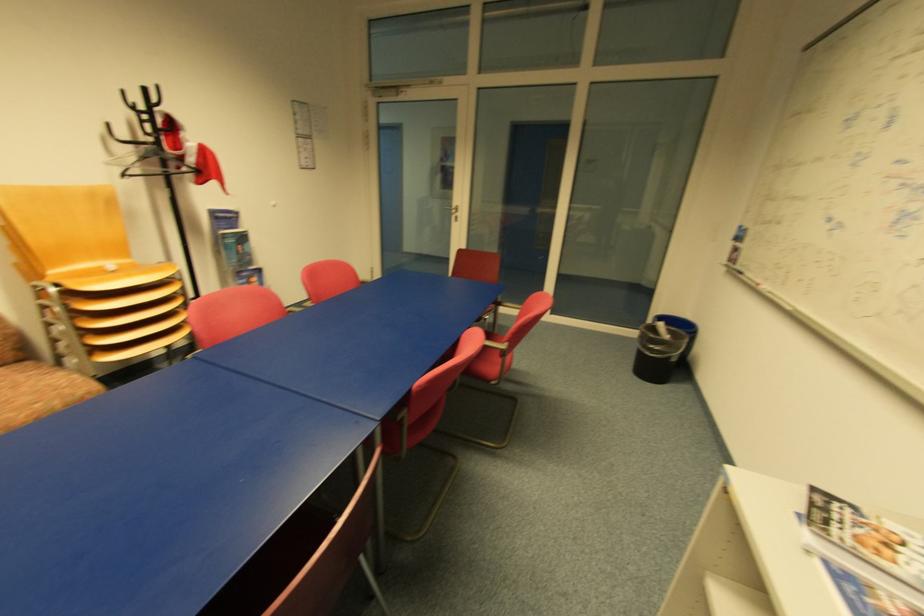
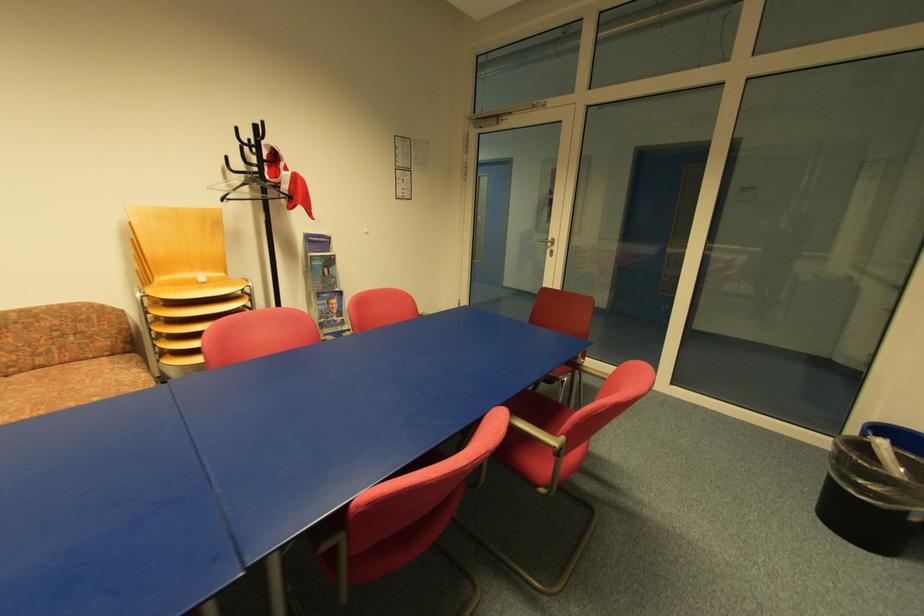
Find the pixel in the second image that matches pixel 454 208 in the first image.

(551, 241)